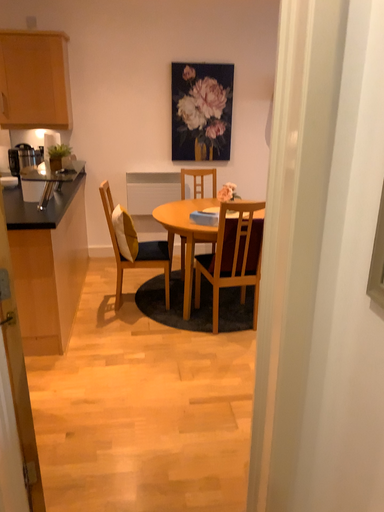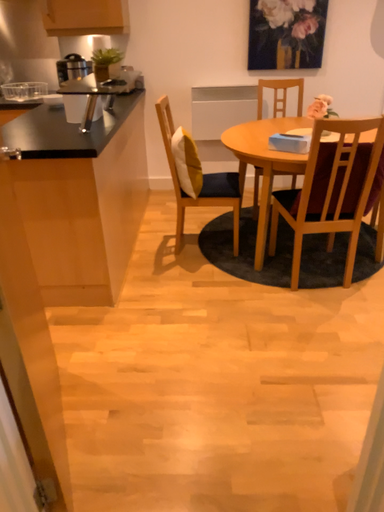
Question: How did the camera likely rotate when shooting the video?

Choices:
 (A) rotated right
 (B) rotated left

Answer: (B)